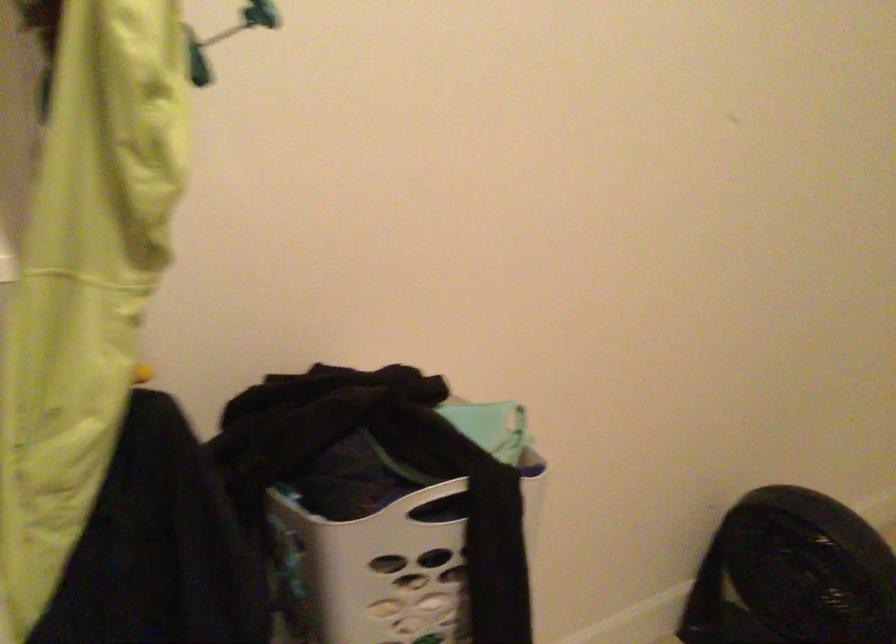
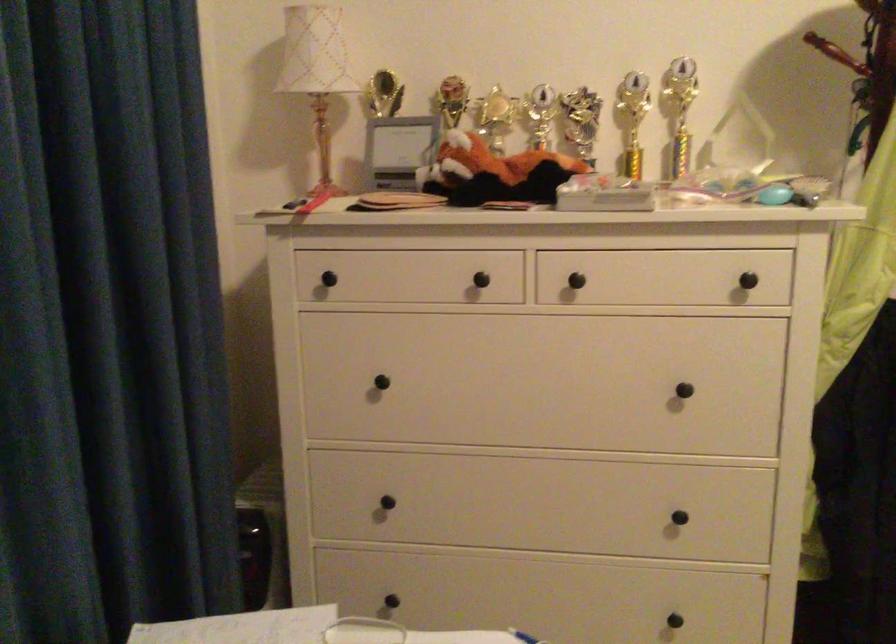
Question: The camera is either moving clockwise (left) or counter-clockwise (right) around the object. The first image is from the beginning of the video and the second image is from the end. Is the camera moving left or right when shooting the video?

Choices:
 (A) Left
 (B) Right

Answer: (B)